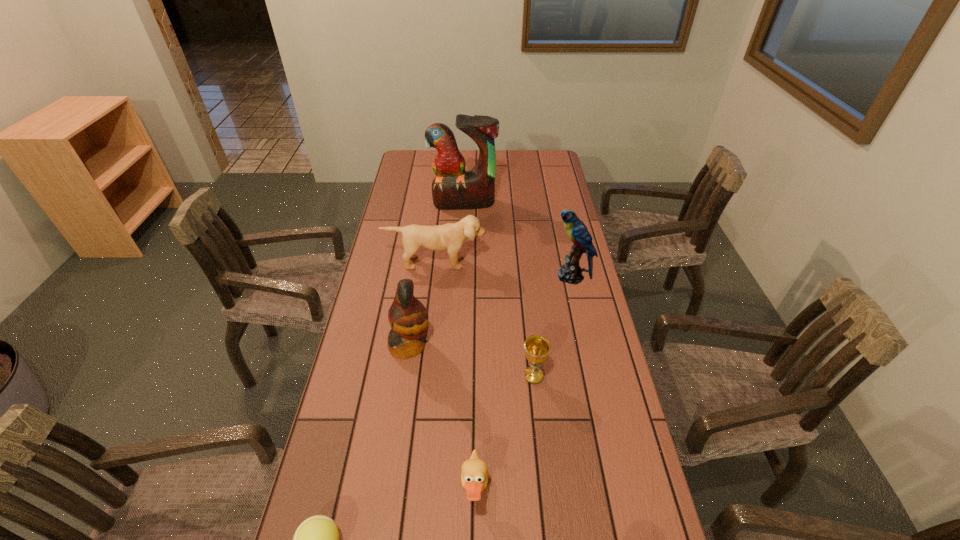
Identify the location of free space located on the face of the fourth nearest object. (541, 346).

At what (x,y) coordinates should I click in order to perform the action: click on vacant space situated 0.210m on the face of the rightmost object. Please return your answer as a coordinate pair (x, y). Image resolution: width=960 pixels, height=540 pixels. Looking at the image, I should click on (491, 276).

Find the location of a particular element. free spot located 0.280m on the face of the rightmost object is located at coordinates (469, 276).

Image resolution: width=960 pixels, height=540 pixels. I want to click on free space located 0.360m on the face of the rightmost object, so click(x=446, y=276).

Where is `free space located on the left side of the fourth shortest object`? The width and height of the screenshot is (960, 540). free space located on the left side of the fourth shortest object is located at coordinates (424, 366).

I want to click on free region located 0.400m on the back of the fifth farthest object, so click(522, 269).

At what (x,y) coordinates should I click in order to perform the action: click on blank area located 0.150m on the beak of the duck. Please return your answer as a coordinate pair (x, y). The image size is (960, 540). Looking at the image, I should click on (556, 490).

At what (x,y) coordinates should I click in order to perform the action: click on parrot that is at the left edge. Please return your answer as a coordinate pair (x, y). The image size is (960, 540). Looking at the image, I should click on (408, 317).

Locate an element on the screen. puppy present at the left edge is located at coordinates (450, 237).

Locate an element on the screen. object that is positioned at the right edge is located at coordinates (571, 272).